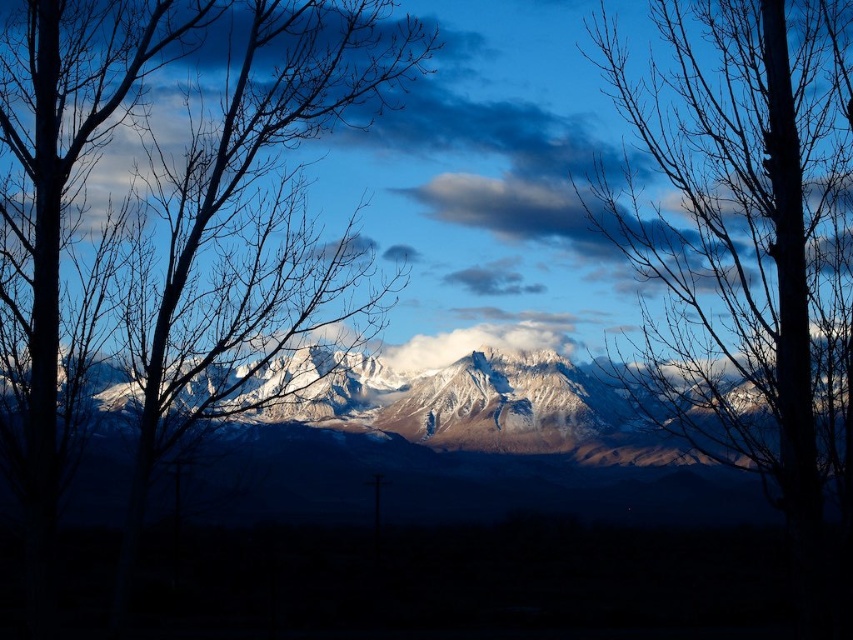
Question: Can you confirm if silhouette bare branches at left is bigger than snowy rock mountain range at center?

Choices:
 (A) no
 (B) yes

Answer: (B)

Question: Estimate the real-world distances between objects in this image. Which object is farther from the silhouette bare branches at left?

Choices:
 (A) snowy rock mountain range at center
 (B) bare branches at center

Answer: (B)

Question: Where is bare branches at center located in relation to silhouette bare branches at left in the image?

Choices:
 (A) right
 (B) left

Answer: (A)

Question: Can you confirm if silhouette bare branches at left is smaller than snowy rock mountain range at center?

Choices:
 (A) no
 (B) yes

Answer: (A)

Question: Which point is farther to the camera?

Choices:
 (A) (366, 104)
 (B) (782, 80)
 (C) (596, 404)

Answer: (C)

Question: Estimate the real-world distances between objects in this image. Which object is closer to the bare branches at center?

Choices:
 (A) snowy rock mountain range at center
 (B) silhouette bare branches at left

Answer: (A)